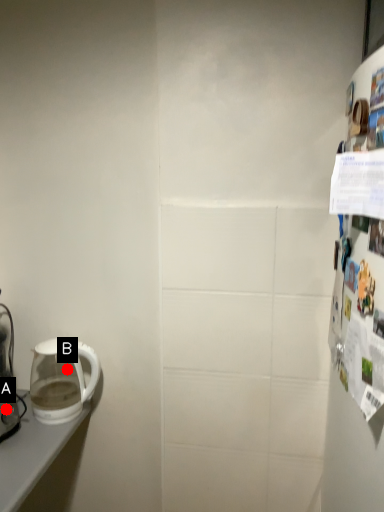
Question: Two points are circled on the image, labeled by A and B beside each circle. Which point is closer to the camera?

Choices:
 (A) A is closer
 (B) B is closer

Answer: (A)